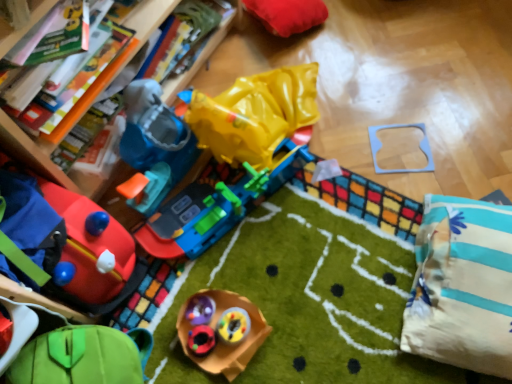
Image resolution: width=512 pixels, height=384 pixels. Find the location of `free spot above rubberized plastic toy at center, the fourth toy in the bottom-to-top sequence (from a real-world perspective)`. free spot above rubberized plastic toy at center, the fourth toy in the bottom-to-top sequence (from a real-world perspective) is located at coordinates [212, 322].